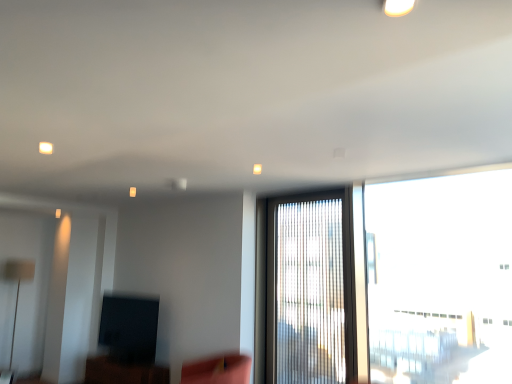
Question: From the image's perspective, would you say matte black tv at lower left is shown under white glossy light fixture at upper center?

Choices:
 (A) yes
 (B) no

Answer: (A)

Question: Considering the relative sizes of matte black tv at lower left and white glossy light fixture at upper center in the image provided, is matte black tv at lower left smaller than white glossy light fixture at upper center?

Choices:
 (A) yes
 (B) no

Answer: (B)

Question: Is matte black tv at lower left looking in the opposite direction of white glossy light fixture at upper center?

Choices:
 (A) yes
 (B) no

Answer: (B)

Question: Is matte black tv at lower left taller than white glossy light fixture at upper center?

Choices:
 (A) no
 (B) yes

Answer: (B)

Question: Can you confirm if matte black tv at lower left is bigger than white glossy light fixture at upper center?

Choices:
 (A) no
 (B) yes

Answer: (B)

Question: Is velvet pink swivel chair at lower center in front of or behind translucent glass window at center, which appears as the 1th window when viewed from the left, in the image?

Choices:
 (A) behind
 (B) front

Answer: (B)

Question: From a real-world perspective, is velvet pink swivel chair at lower center positioned above or below translucent glass window at center, which appears as the 1th window when viewed from the left?

Choices:
 (A) above
 (B) below

Answer: (B)

Question: Is velvet pink swivel chair at lower center situated inside translucent glass window at center, which appears as the 1th window when viewed from the left, or outside?

Choices:
 (A) outside
 (B) inside

Answer: (A)

Question: In the image, is velvet pink swivel chair at lower center on the left side or the right side of translucent glass window at center, which appears as the 1th window when viewed from the left?

Choices:
 (A) left
 (B) right

Answer: (A)

Question: In terms of width, does white glossy light fixture at upper center look wider or thinner when compared to matte black tv at lower left?

Choices:
 (A) wide
 (B) thin

Answer: (B)

Question: Relative to matte black tv at lower left, is white glossy light fixture at upper center in front or behind?

Choices:
 (A) behind
 (B) front

Answer: (B)

Question: From a real-world perspective, relative to matte black tv at lower left, is white glossy light fixture at upper center vertically above or below?

Choices:
 (A) above
 (B) below

Answer: (A)

Question: Does point (393, 13) appear closer or farther from the camera than point (138, 377)?

Choices:
 (A) closer
 (B) farther

Answer: (A)

Question: Is white glossy light fixture at upper center wider or thinner than velvet pink swivel chair at lower center?

Choices:
 (A) thin
 (B) wide

Answer: (A)

Question: From the image's perspective, relative to velvet pink swivel chair at lower center, is white glossy light fixture at upper center above or below?

Choices:
 (A) above
 (B) below

Answer: (A)